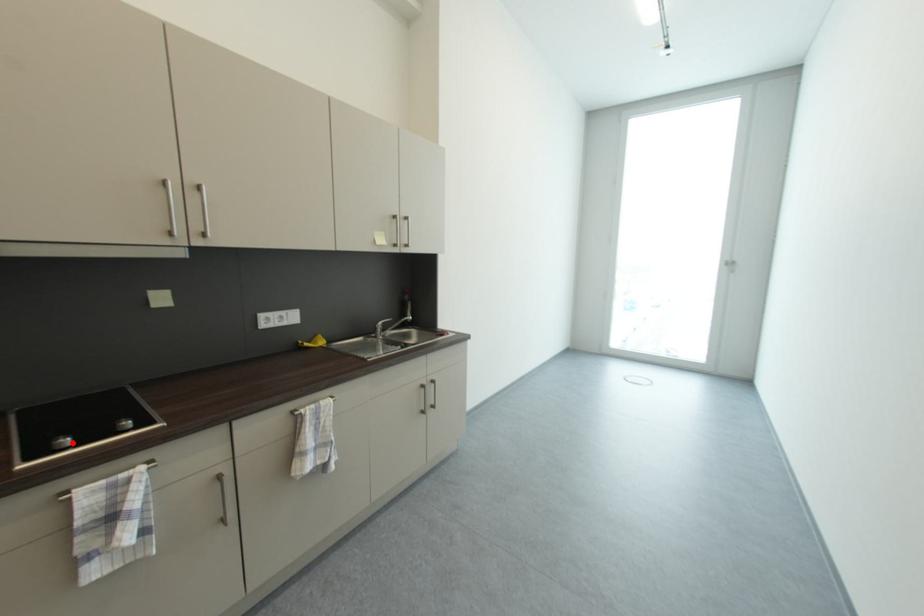
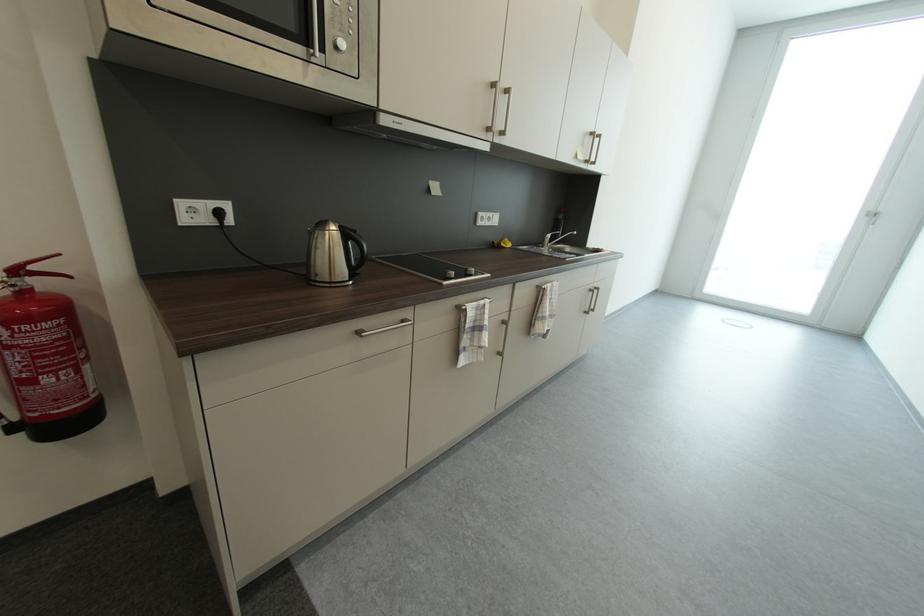
Find the pixel in the second image that matches the highlighted location in the first image.

(458, 275)